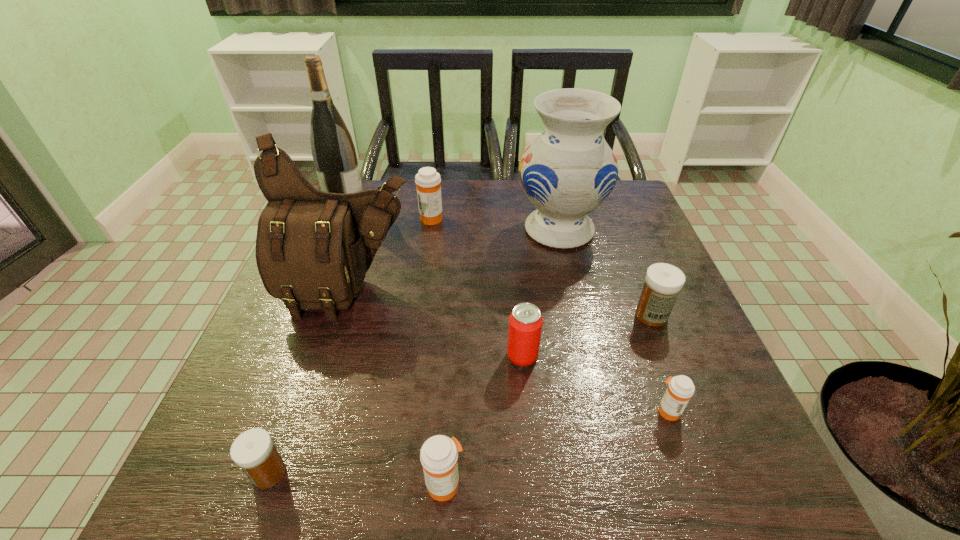
The width and height of the screenshot is (960, 540). What are the coordinates of `vase positioned at the right edge` in the screenshot? It's located at (569, 170).

The width and height of the screenshot is (960, 540). Find the location of `object present at the far left corner`. object present at the far left corner is located at coordinates click(333, 151).

You are a GUI agent. You are given a task and a screenshot of the screen. Output one action in this format:
    pyautogui.click(x=<x>, y=<y>)
    Task: Click on the object located in the near left corner section of the desktop
    This screenshot has height=540, width=960.
    Given the screenshot: What is the action you would take?
    pyautogui.click(x=253, y=451)

Find the location of a particular element. object that is at the far right corner is located at coordinates (569, 170).

Identify the location of vacant position at the far edge of the desktop. (415, 202).

In the image, there is a desktop. Where is `vacant space at the near edge`? This screenshot has width=960, height=540. vacant space at the near edge is located at coordinates (387, 481).

This screenshot has height=540, width=960. What are the coordinates of `blank area at the left edge` in the screenshot? It's located at (268, 338).

This screenshot has width=960, height=540. In the image, there is a desktop. Identify the location of vacant space at the right edge. (612, 299).

Locate an element on the screen. This screenshot has height=540, width=960. vacant region at the far right corner of the desktop is located at coordinates (627, 212).

In order to click on vacant area that lies between the third medicine from left to right and the vase in this screenshot , I will do `click(502, 357)`.